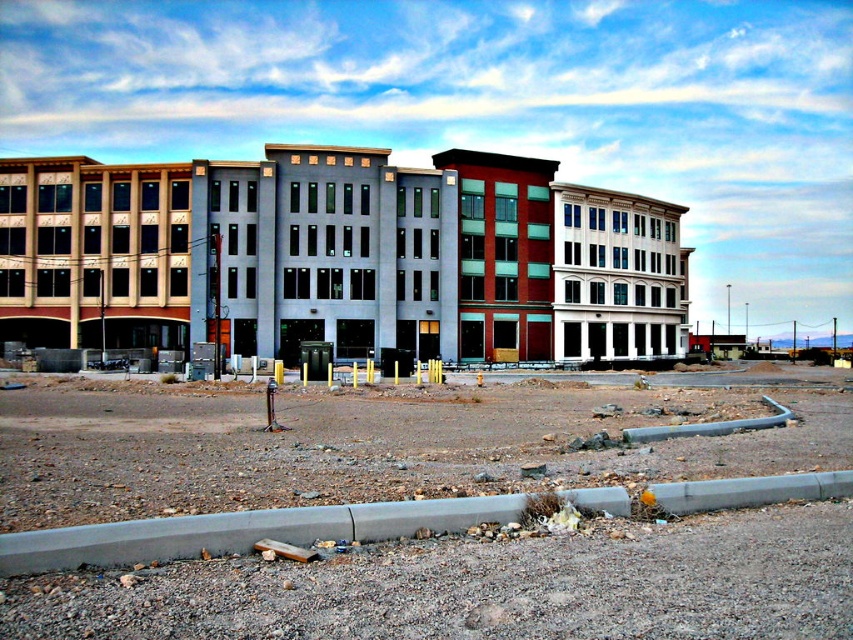
You are a construction worker carrying a 100 foot long steel beam. You need to transport it from the brown gravel dirt field at lower center to the matte gray building at center. Can the steel beam be placed directly between them without bending or breaking?

The distance between the brown gravel dirt field at lower center and the matte gray building at center is 117.71 feet. Since the steel beam is only 100 feet long, it would not reach the building, making it impossible to place it directly between them without bending or breaking.

You are a construction worker who needs to determine where to place a new temporary storage container. The container requires a flat, stable area. Based on the scene, which location between the brown gravel dirt field at lower center and the matte gray building at center would be more suitable for placing the container?

The matte gray building at center is more suitable for placing the container as it occupies more space than the brown gravel dirt field at lower center, providing a larger and potentially more stable area.

You are a construction worker standing at the entrance of the building. You need to place a heavy equipment at the point marked as point (485, 588). According to the image, what is the terrain like at that specific location?

The brown gravel dirt field at lower center is located at point (485, 588), so the terrain there is a brown gravel dirt field.